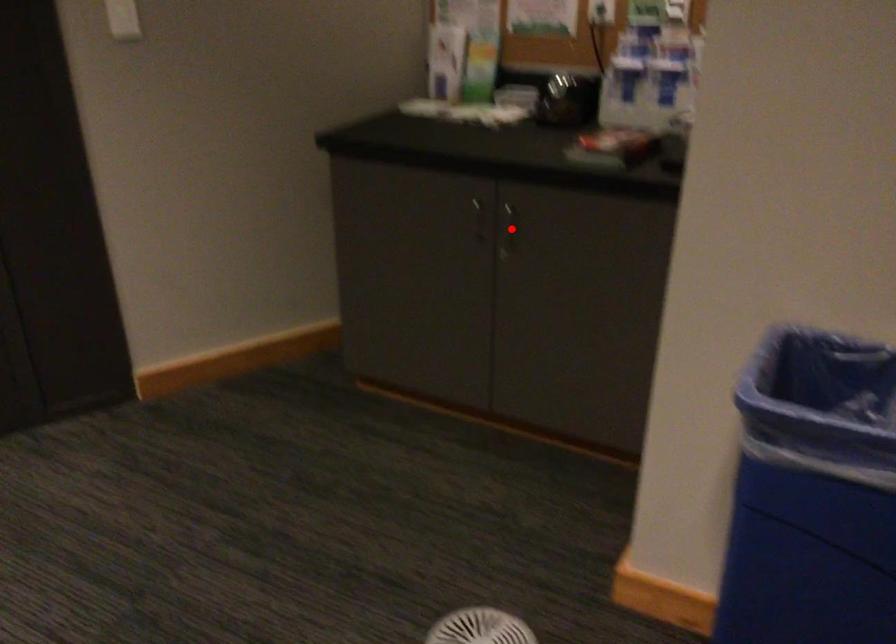
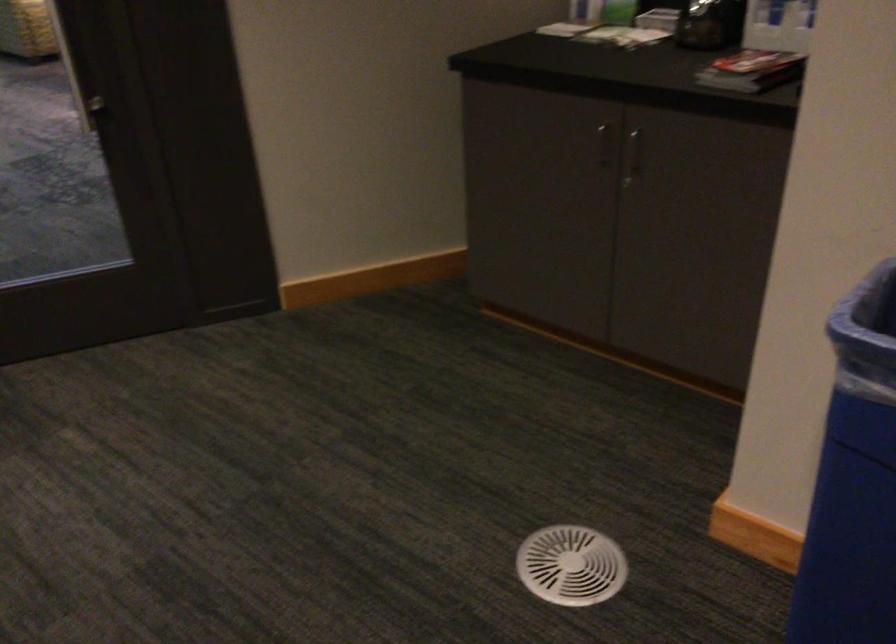
Locate, in the second image, the point that corresponds to the highlighted location in the first image.

(633, 155)